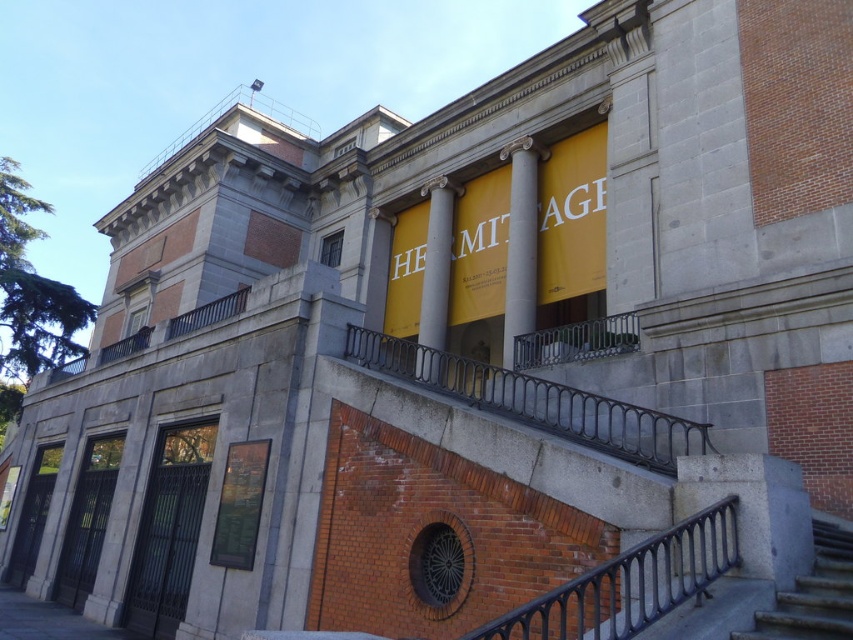
Does black metal railing at lower right appear on the right side of smooth concrete stairs at lower right?

No, black metal railing at lower right is not to the right of smooth concrete stairs at lower right.

Which of these two, black metal railing at lower right or smooth concrete stairs at lower right, stands taller?

black metal railing at lower right

Find the location of a particular element. black metal railing at lower right is located at coordinates (630, 582).

Does gray stone column at center have a lesser width compared to white marble pillar at center?

No, gray stone column at center is not thinner than white marble pillar at center.

Is point (508, 301) in front of point (430, 250)?

Yes.

At what (x,y) coordinates should I click in order to perform the action: click on gray stone column at center. Please return your answer as a coordinate pair (x, y). Image resolution: width=853 pixels, height=640 pixels. Looking at the image, I should click on (520, 243).

Can you confirm if smooth concrete stairs at lower right is positioned above white marble pillar at center?

No.

Does smooth concrete stairs at lower right appear on the right side of white marble pillar at center?

Indeed, smooth concrete stairs at lower right is positioned on the right side of white marble pillar at center.

The height and width of the screenshot is (640, 853). I want to click on smooth concrete stairs at lower right, so click(x=813, y=595).